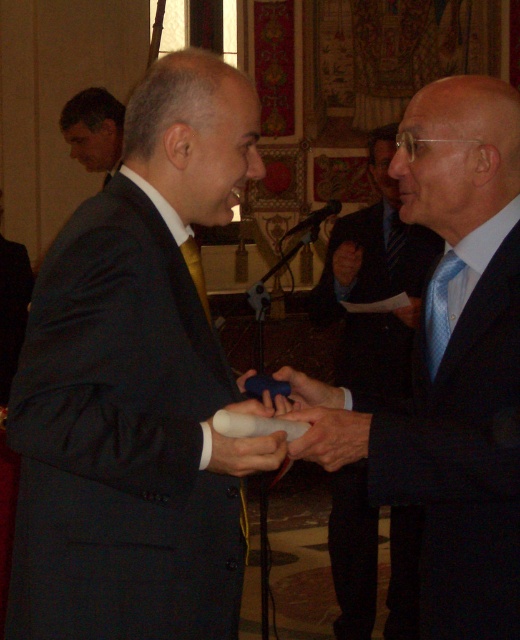
Between matte black suit at upper left and yellow satin tie at center, which one is positioned lower?

yellow satin tie at center is lower down.

Can you confirm if matte black suit at upper left is bigger than yellow satin tie at center?

Yes.

Image resolution: width=520 pixels, height=640 pixels. I want to click on matte black suit at upper left, so click(94, 129).

Can you confirm if blue silk tie at right is shorter than blue dotted tie at right?

In fact, blue silk tie at right may be taller than blue dotted tie at right.

Consider the image. Is blue silk tie at right wider than blue dotted tie at right?

Indeed, blue silk tie at right has a greater width compared to blue dotted tie at right.

Who is more distant from viewer, (486, 256) or (438, 346)?

Positioned behind is point (438, 346).

Where is `blue silk tie at right`? This screenshot has height=640, width=520. blue silk tie at right is located at coordinates (461, 364).

Which is more to the right, matte black suit at center or blue silk tie at right?

Positioned to the right is blue silk tie at right.

Does matte black suit at center appear over blue silk tie at right?

Actually, matte black suit at center is below blue silk tie at right.

Does point (188, 448) come behind point (496, 460)?

No, it is in front of (496, 460).

The height and width of the screenshot is (640, 520). In order to click on matte black suit at center in this screenshot , I will do `click(137, 387)`.